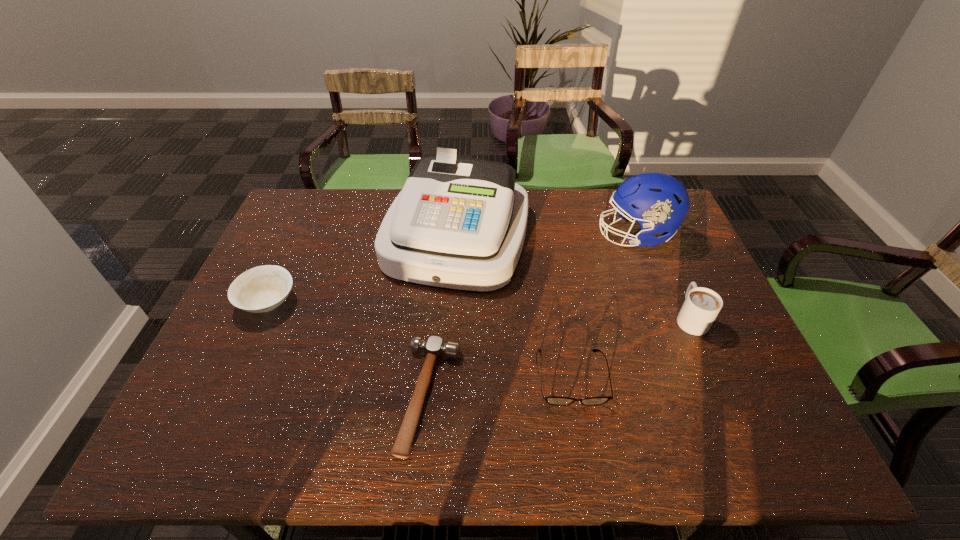
Identify the location of the fourth closest object relative to the spectacles. The image size is (960, 540). [x=659, y=203].

Where is `free space that satisfies the following two spatial constraints: 1. on the face guard of the football helmet; 2. on the front-facing side of the spectacles`? The height and width of the screenshot is (540, 960). free space that satisfies the following two spatial constraints: 1. on the face guard of the football helmet; 2. on the front-facing side of the spectacles is located at coordinates (691, 377).

This screenshot has height=540, width=960. In order to click on vacant point that satisfies the following two spatial constraints: 1. on the face guard of the football helmet; 2. on the front-facing side of the spectacles in this screenshot , I will do `click(691, 377)`.

Find the location of `free space in the image that satisfies the following two spatial constraints: 1. on the face guard of the football helmet; 2. on the front side of the hammer`. free space in the image that satisfies the following two spatial constraints: 1. on the face guard of the football helmet; 2. on the front side of the hammer is located at coordinates (698, 396).

The image size is (960, 540). Identify the location of free location that satisfies the following two spatial constraints: 1. on the face guard of the football helmet; 2. on the front-facing side of the spectacles. (691, 377).

Where is `vacant area that satisfies the following two spatial constraints: 1. on the side with the handle of the cappuccino; 2. on the face guard of the football helmet`? The width and height of the screenshot is (960, 540). vacant area that satisfies the following two spatial constraints: 1. on the side with the handle of the cappuccino; 2. on the face guard of the football helmet is located at coordinates (655, 235).